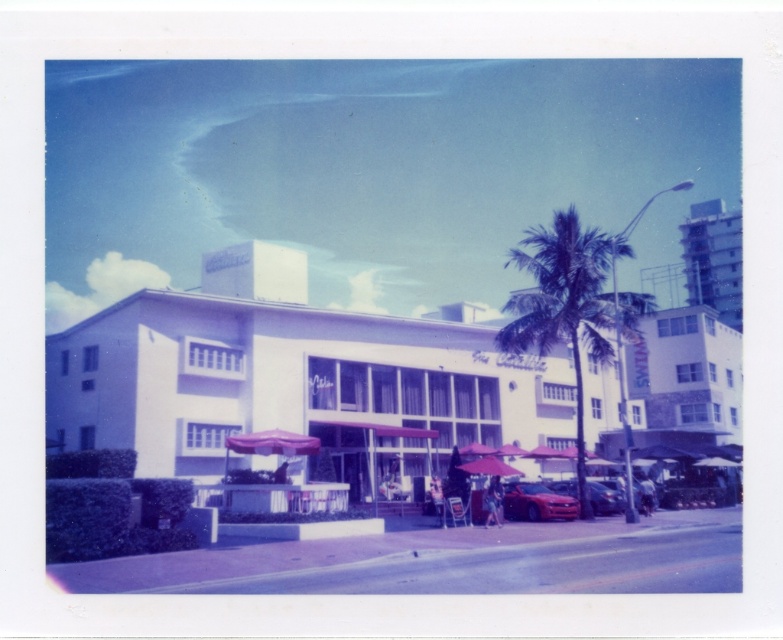
You are a pedestrian holding an umbrella and a car owner of the shiny red car at lower right. You want to park your car under the pink fabric umbrella at center to avoid the rain. Is it possible to park the car there?

The pink fabric umbrella at center is positioned over the shiny red car at lower right, so yes, you can park the shiny red car at lower right under the pink fabric umbrella at center to stay dry.